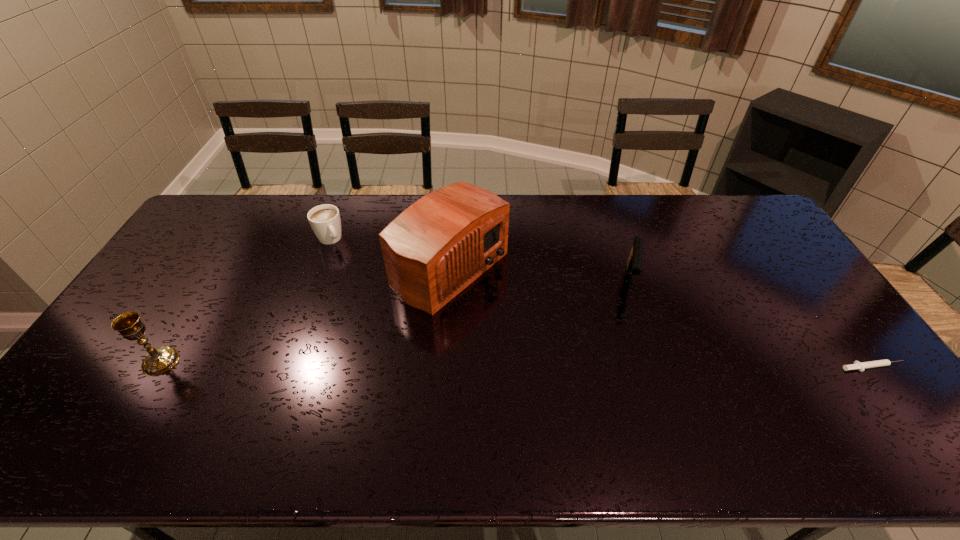
Select which object is the closest to the cappuccino. Please provide its 2D coordinates. Your answer should be formatted as a tuple, i.e. [(x, y)], where the tuple contains the x and y coordinates of a point satisfying the conditions above.

[(435, 248)]